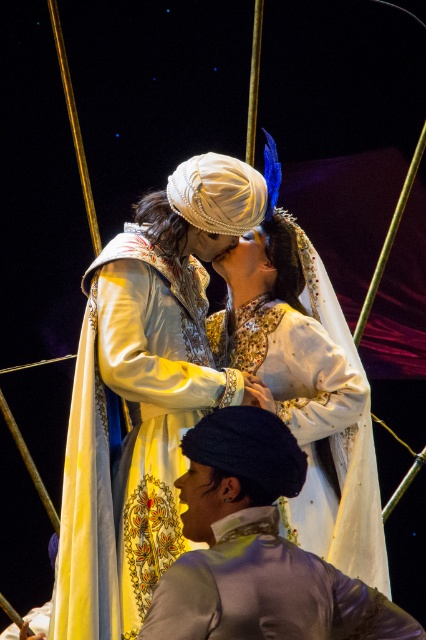
Question: Among these points, which one is nearest to the camera?

Choices:
 (A) (189, 621)
 (B) (342, 440)
 (C) (367, 401)

Answer: (A)

Question: Which of these objects is positioned closest to the white embroidered dress at center?

Choices:
 (A) silvery metallic jacket at center
 (B) silk embroidered dress at center

Answer: (B)

Question: In this image, where is silk embroidered dress at center located relative to white embroidered dress at center?

Choices:
 (A) below
 (B) above

Answer: (B)

Question: Does silvery metallic jacket at center have a larger size compared to white embroidered dress at center?

Choices:
 (A) yes
 (B) no

Answer: (B)

Question: Does silvery metallic jacket at center lie behind white embroidered dress at center?

Choices:
 (A) no
 (B) yes

Answer: (A)

Question: Considering the real-world distances, which object is closest to the white embroidered dress at center?

Choices:
 (A) silk embroidered dress at center
 (B) silvery metallic jacket at center

Answer: (A)